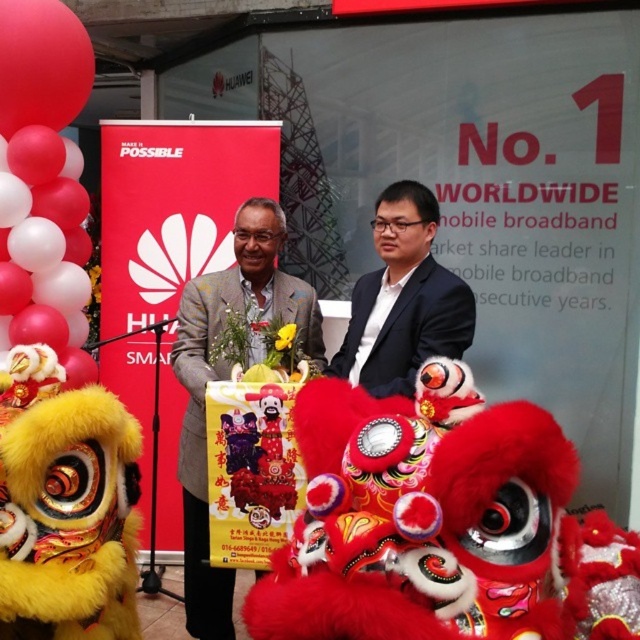
You are at a corporate event and see the Huawei logo and slogan in the background. There is also a point marked at coordinates (44, 182). What is located at that point?

The point at (44, 182) indicates red matte balloons at upper left.

You are attending a corporate event and see the red matte balloons at upper left and the black glossy suit at center. From your perspective, which object is positioned more to the left?

The red matte balloons at upper left are positioned more to the left than the black glossy suit at center.

You are a photographer at this Huawei event. You want to capture a photo where both the red matte balloons at upper left and the black glossy suit at center are visible. Given their sizes, which object will appear bigger in the photo?

The red matte balloons at upper left will appear bigger in the photo because they are larger in size than the black glossy suit at center.